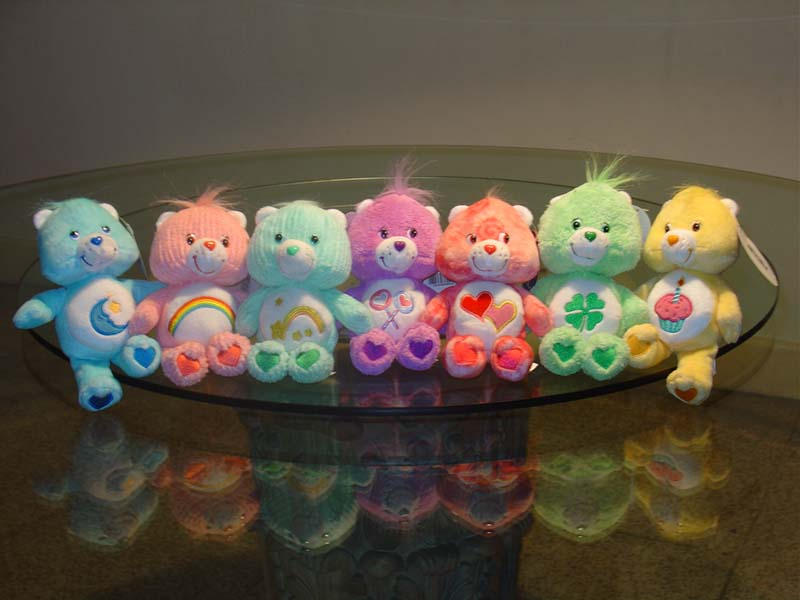
Where is `green stuffed bear`? The height and width of the screenshot is (600, 800). green stuffed bear is located at coordinates (594, 203).